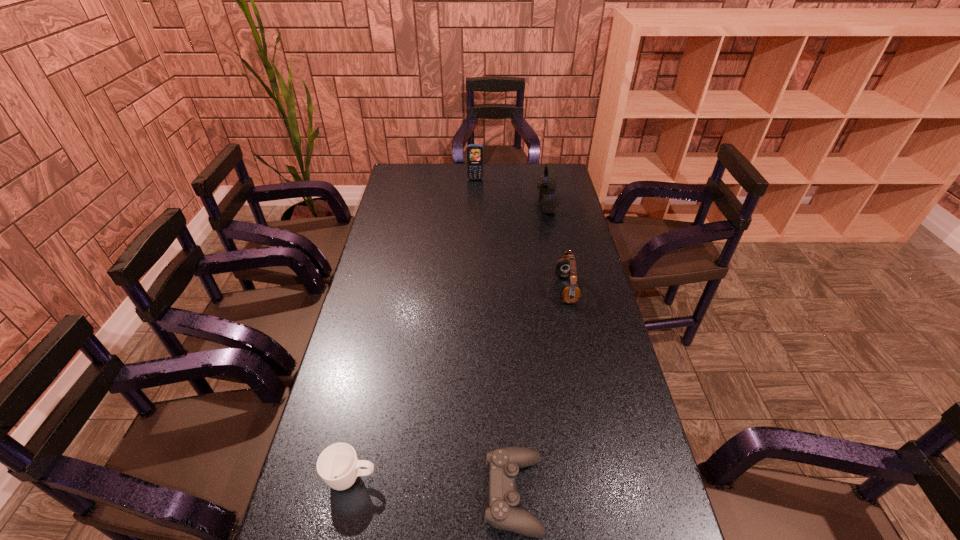
Identify the location of vacant space located on the screen of the cellular telephone. Image resolution: width=960 pixels, height=540 pixels. (475, 198).

Identify the location of free space located 0.310m on the ear cups of the third nearest object. (468, 289).

I want to click on vacant space located on the ear cups of the third nearest object, so click(537, 289).

Locate an element on the screen. This screenshot has width=960, height=540. free region located 0.210m on the ear cups of the third nearest object is located at coordinates (496, 289).

What are the coordinates of `free region located 0.330m with the handle on the side of the leftmost object` in the screenshot? It's located at (516, 478).

You are a GUI agent. You are given a task and a screenshot of the screen. Output one action in this format:
    pyautogui.click(x=<x>, y=<y>)
    Task: Click on the object present at the far edge
    Image resolution: width=960 pixels, height=540 pixels.
    Given the screenshot: What is the action you would take?
    pyautogui.click(x=475, y=152)

Image resolution: width=960 pixels, height=540 pixels. In order to click on object that is at the left edge in this screenshot , I will do `click(338, 465)`.

I want to click on vacant space at the far edge, so click(427, 185).

The width and height of the screenshot is (960, 540). What are the coordinates of `vacant area at the left edge` in the screenshot? It's located at (359, 529).

You are a GUI agent. You are given a task and a screenshot of the screen. Output one action in this format:
    pyautogui.click(x=<x>, y=<y>)
    Task: Click on the free space at the right edge
    The height and width of the screenshot is (540, 960).
    Given the screenshot: What is the action you would take?
    pyautogui.click(x=574, y=245)